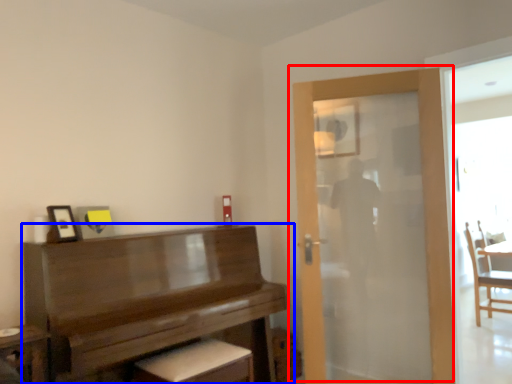
Question: Which point is closer to the camera, door (highlighted by a red box) or piano (highlighted by a blue box)?

Choices:
 (A) door
 (B) piano

Answer: (B)